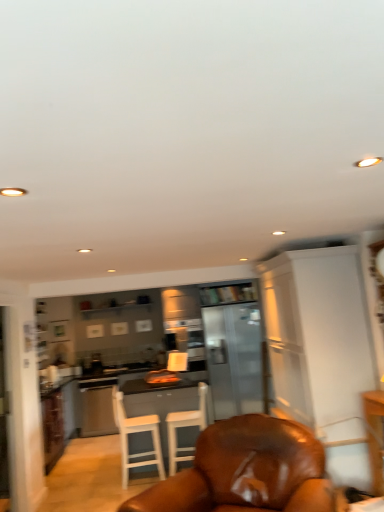
Question: Should I look upward or downward to see satin silver dishwasher at center?

Choices:
 (A) down
 (B) up

Answer: (A)

Question: From a real-world perspective, does brown leather chair at center, arranged as the first chair when viewed from the front, stand above white wood chair at center, the third chair positioned from the front?

Choices:
 (A) yes
 (B) no

Answer: (A)

Question: Is the depth of brown leather chair at center, arranged as the first chair when viewed from the front, less than that of white wood chair at center, placed as the first chair when sorted from back to front?

Choices:
 (A) no
 (B) yes

Answer: (B)

Question: Does brown leather chair at center, arranged as the first chair when viewed from the front, have a lesser width compared to white wood chair at center, placed as the first chair when sorted from back to front?

Choices:
 (A) no
 (B) yes

Answer: (A)

Question: Can you confirm if brown leather chair at center, which is counted as the third chair, starting from the back, is bigger than white wood chair at center, placed as the first chair when sorted from back to front?

Choices:
 (A) yes
 (B) no

Answer: (A)

Question: Considering the relative positions of brown leather chair at center, arranged as the first chair when viewed from the front, and white wood chair at center, the third chair positioned from the front, in the image provided, is brown leather chair at center, arranged as the first chair when viewed from the front, to the left of white wood chair at center, the third chair positioned from the front, from the viewer's perspective?

Choices:
 (A) no
 (B) yes

Answer: (A)

Question: Does brown leather chair at center, which is counted as the third chair, starting from the back, have a larger size compared to wooden bookshelf at center?

Choices:
 (A) no
 (B) yes

Answer: (B)

Question: Can you confirm if brown leather chair at center, which is counted as the third chair, starting from the back, is wider than wooden bookshelf at center?

Choices:
 (A) yes
 (B) no

Answer: (A)

Question: Is brown leather chair at center, arranged as the first chair when viewed from the front, to the right of wooden bookshelf at center from the viewer's perspective?

Choices:
 (A) yes
 (B) no

Answer: (B)

Question: Is brown leather chair at center, which is counted as the third chair, starting from the back, closer to camera compared to wooden bookshelf at center?

Choices:
 (A) no
 (B) yes

Answer: (B)

Question: Would you consider brown leather chair at center, which is counted as the third chair, starting from the back, to be distant from wooden bookshelf at center?

Choices:
 (A) yes
 (B) no

Answer: (A)

Question: From the image's perspective, is brown leather chair at center, arranged as the first chair when viewed from the front, located beneath wooden bookshelf at center?

Choices:
 (A) no
 (B) yes

Answer: (B)

Question: Does wooden bookshelf at center appear on the right side of satin silver dishwasher at center?

Choices:
 (A) no
 (B) yes

Answer: (B)